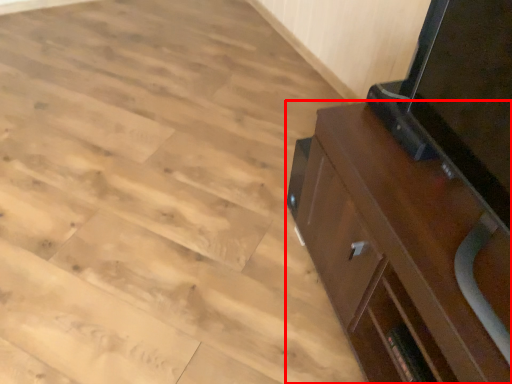
Question: From the image's perspective, considering the relative positions of cabinetry (annotated by the red box) and plywood in the image provided, where is cabinetry (annotated by the red box) located with respect to the staircase?

Choices:
 (A) above
 (B) below

Answer: (B)